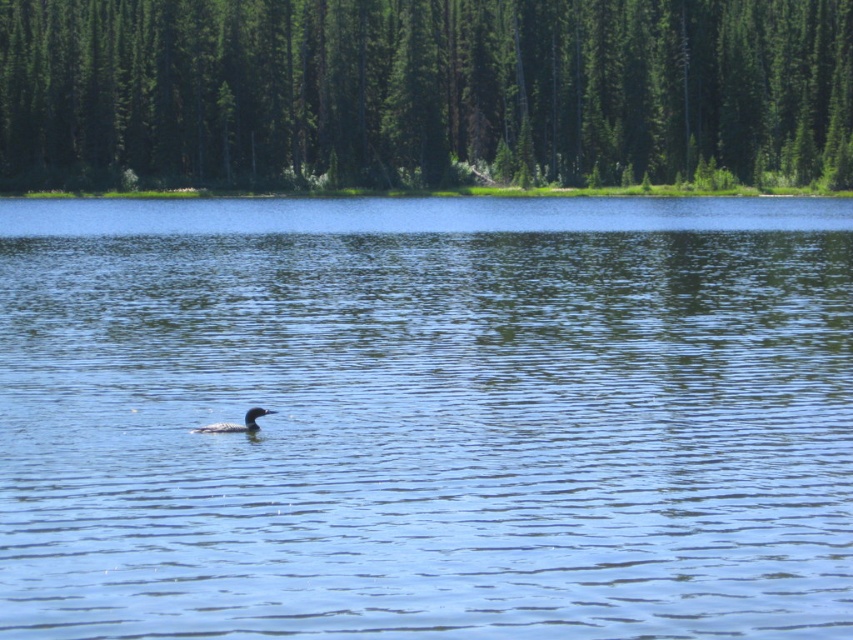
You are observing a serene lake scene. There is blue water at center and a dark gray matte duck at center. Which object is closer to you?

The blue water at center is closer to the viewer than the dark gray matte duck at center.